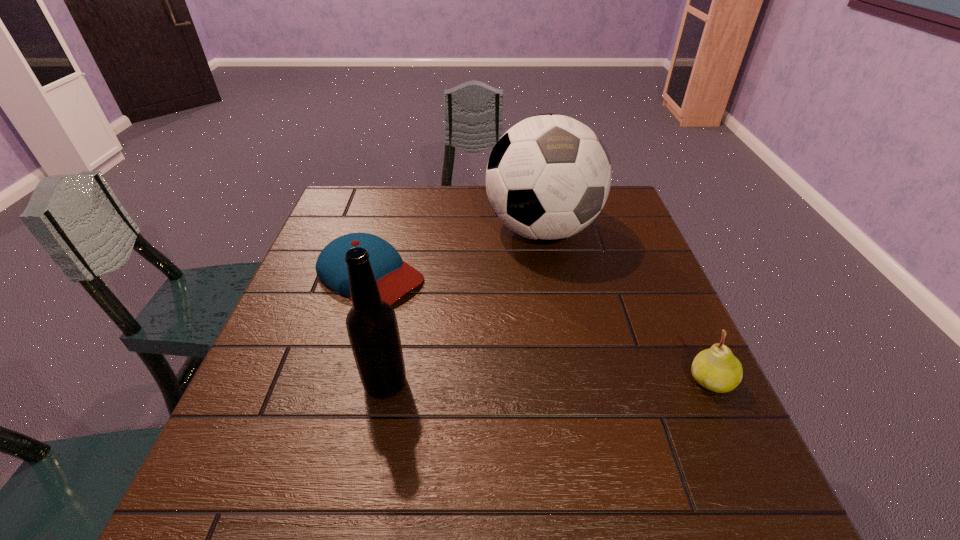
Where is `free spot between the pear and the beer bottle`? This screenshot has width=960, height=540. free spot between the pear and the beer bottle is located at coordinates (548, 382).

Where is `free spot between the third object from left to right and the pear`? free spot between the third object from left to right and the pear is located at coordinates (626, 306).

Where is `free space between the baseball cap and the third tallest object`? free space between the baseball cap and the third tallest object is located at coordinates (540, 328).

Image resolution: width=960 pixels, height=540 pixels. I want to click on free space between the beer bottle and the rightmost object, so pos(548,382).

Image resolution: width=960 pixels, height=540 pixels. I want to click on free spot between the beer bottle and the pear, so click(x=548, y=382).

Locate an element on the screen. The height and width of the screenshot is (540, 960). the second closest object to the soccer ball is located at coordinates (716, 369).

Locate which object is the closest to the third object from left to right. Please provide its 2D coordinates. Your answer should be formatted as a tuple, i.e. [(x, y)], where the tuple contains the x and y coordinates of a point satisfying the conditions above.

[(394, 277)]

Image resolution: width=960 pixels, height=540 pixels. I want to click on vacant region that satisfies the following two spatial constraints: 1. on the back side of the beer bottle; 2. on the left side of the rightmost object, so click(x=386, y=381).

At what (x,y) coordinates should I click in order to perform the action: click on vacant space that satisfies the following two spatial constraints: 1. on the back side of the second object from right to left; 2. on the right side of the shortest object. Please return your answer as a coordinate pair (x, y). The height and width of the screenshot is (540, 960). Looking at the image, I should click on (383, 230).

Where is `free spot that satisfies the following two spatial constraints: 1. on the back side of the second object from right to left; 2. on the right side of the baseball cap`? free spot that satisfies the following two spatial constraints: 1. on the back side of the second object from right to left; 2. on the right side of the baseball cap is located at coordinates (383, 230).